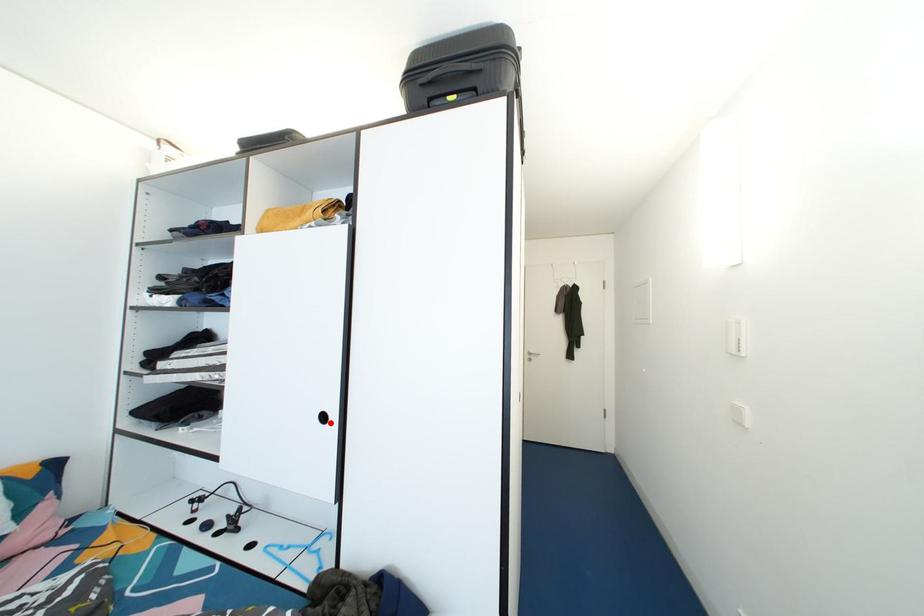
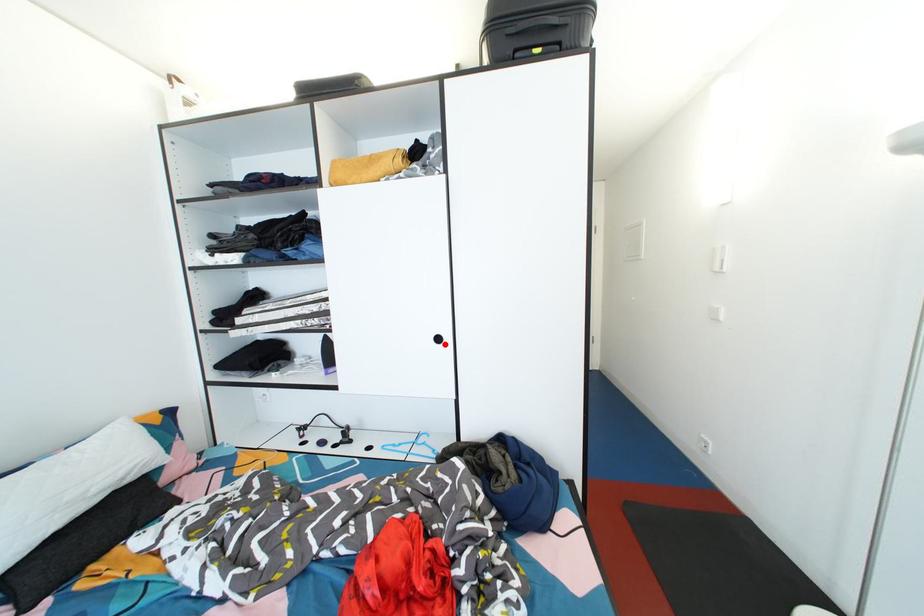
I am providing you with two images of the same scene from different viewpoints. A red point is marked on the first image and another point is marked on the second image. Is the marked point in image1 the same physical position as the marked point in image2?

Yes